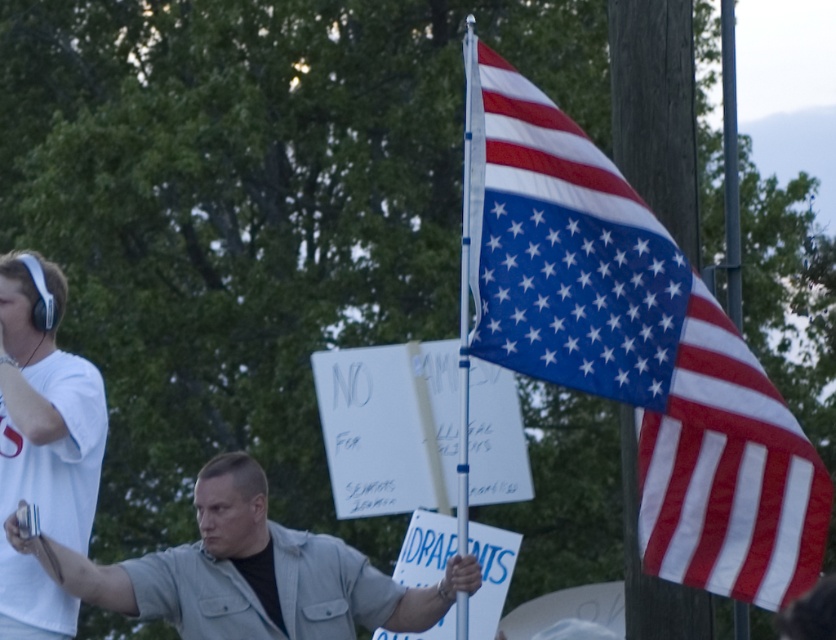
Can you confirm if light gray denim jacket at center is positioned to the left of white matte headphones at upper left?

Incorrect, light gray denim jacket at center is not on the left side of white matte headphones at upper left.

Which is in front, point (182, 570) or point (18, 326)?

Positioned in front is point (18, 326).

Locate an element on the screen. This screenshot has height=640, width=836. light gray denim jacket at center is located at coordinates (250, 572).

Does polyester american flag at right have a greater height compared to white matte headphones at upper left?

Indeed, polyester american flag at right has a greater height compared to white matte headphones at upper left.

From the picture: Can you confirm if polyester american flag at right is positioned below white matte headphones at upper left?

No, polyester american flag at right is not below white matte headphones at upper left.

You are a GUI agent. You are given a task and a screenshot of the screen. Output one action in this format:
    pyautogui.click(x=<x>, y=<y>)
    Task: Click on the polyester american flag at right
    The image size is (836, 640).
    Given the screenshot: What is the action you would take?
    pyautogui.click(x=636, y=348)

Between point (475, 122) and point (355, 600), which one is positioned in front?

Positioned in front is point (475, 122).

Locate an element on the screen. This screenshot has width=836, height=640. polyester american flag at right is located at coordinates (636, 348).